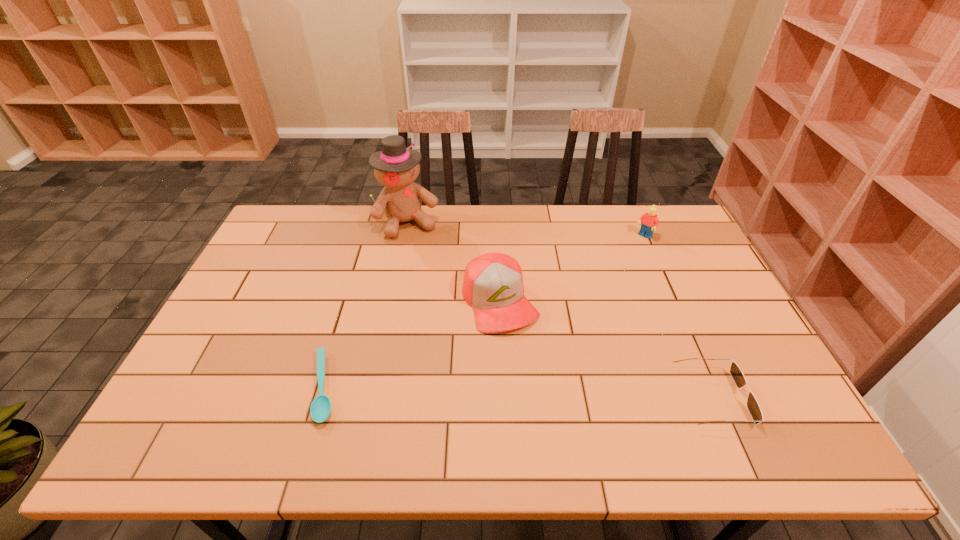
Where is `sunglasses present at the right edge`? This screenshot has height=540, width=960. sunglasses present at the right edge is located at coordinates (736, 373).

I want to click on Lego present at the right edge, so click(649, 220).

This screenshot has width=960, height=540. I want to click on object present at the far right corner, so click(x=649, y=220).

The width and height of the screenshot is (960, 540). I want to click on object located at the near right corner, so click(x=736, y=373).

This screenshot has height=540, width=960. Identify the location of vacant space at the far edge of the desktop. (444, 224).

In the image, there is a desktop. Find the location of `vacant space at the near edge`. vacant space at the near edge is located at coordinates coord(529,410).

Identify the location of vacant space at the left edge of the desktop. This screenshot has height=540, width=960. (287, 265).

I want to click on vacant space at the right edge, so click(706, 337).

Where is `vacant space at the far left corner`? The height and width of the screenshot is (540, 960). vacant space at the far left corner is located at coordinates (314, 217).

This screenshot has height=540, width=960. In order to click on vacant area between the baseball cap and the Lego in this screenshot , I will do `click(571, 269)`.